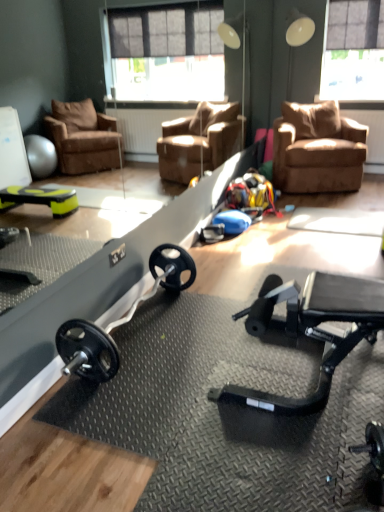
The height and width of the screenshot is (512, 384). I want to click on vacant space in front of black rubber barbell at center, so click(x=154, y=419).